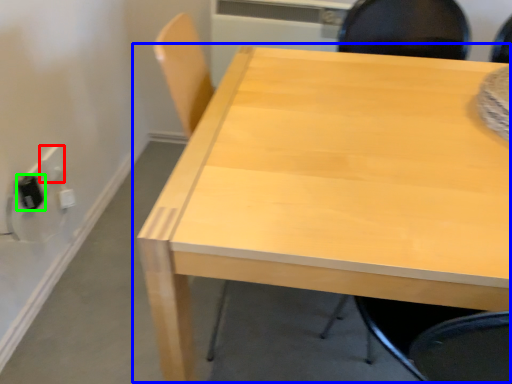
Question: Which object is the farthest from electric outlet (highlighted by a red box)? Choose among these: table (highlighted by a blue box) or electric outlet (highlighted by a green box).

Choices:
 (A) table
 (B) electric outlet

Answer: (A)